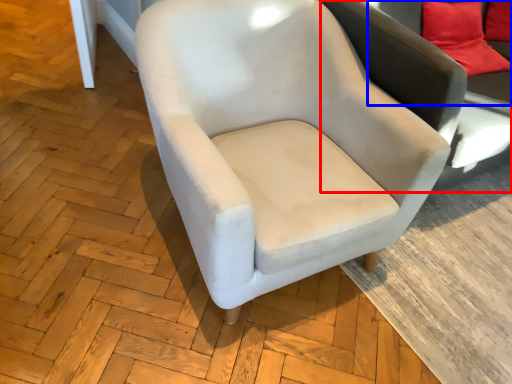
Question: Which object appears farthest to the camera in this image, swivel chair (highlighted by a red box) or couch (highlighted by a blue box)?

Choices:
 (A) swivel chair
 (B) couch

Answer: (B)